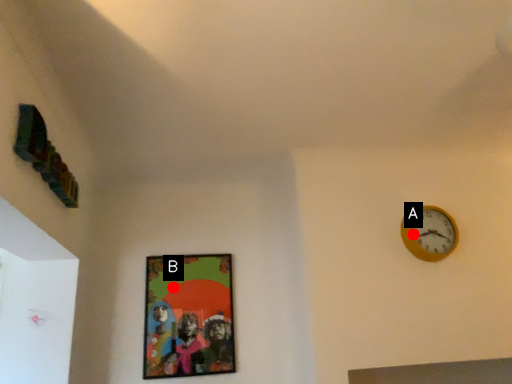
Question: Two points are circled on the image, labeled by A and B beside each circle. Among these points, which one is nearest to the camera?

Choices:
 (A) A is closer
 (B) B is closer

Answer: (A)